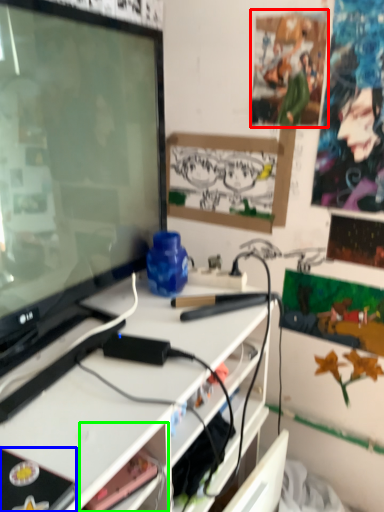
Question: Which object is the farthest from poster (highlighted by a red box)? Choose among these: equipment (highlighted by a blue box) or shelf (highlighted by a green box).

Choices:
 (A) equipment
 (B) shelf

Answer: (A)